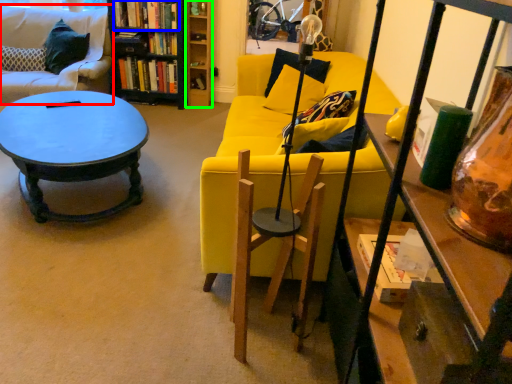
Question: Considering the real-world distances, which object is closest to studio couch (highlighted by a red box)? book (highlighted by a blue box) or shelf (highlighted by a green box).

Choices:
 (A) book
 (B) shelf

Answer: (A)